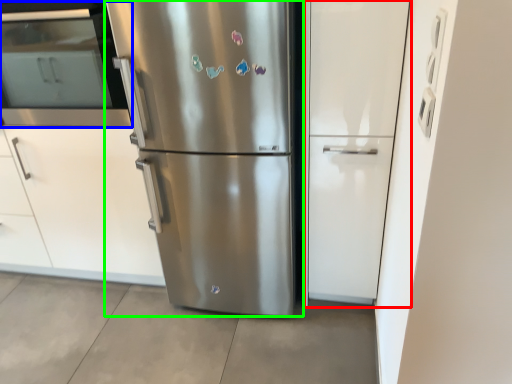
Question: Which object is positioned farthest from glass door (highlighted by a red box)? Select from oven (highlighted by a blue box) and refrigerator (highlighted by a green box).

Choices:
 (A) oven
 (B) refrigerator

Answer: (A)